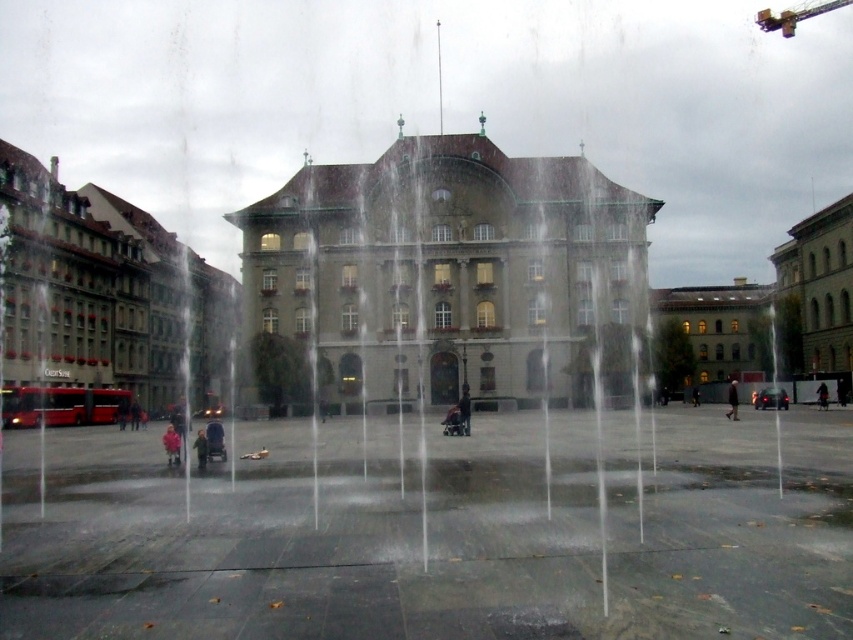
You are observing the urban square through the rainy window. There is a dark gray fabric jacket at center. Can you determine if the jacket is positioned closer to the bottom or the top of the image?

The dark gray fabric jacket at center is located at point 0.859 on the vertical axis, which places it closer to the bottom of the image since the coordinate system likely starts from the top left corner.

You are a photographer standing in the square and want to take a photo of the historic building. However, two people wearing jackets are blocking your view. The people are wearing a dark gray fabric jacket at center and a dark blue jacket at center. Which jacket is larger and might be blocking more of the building?

The dark gray fabric jacket at center is bigger than the dark blue jacket at center, so it might be blocking more of the building.